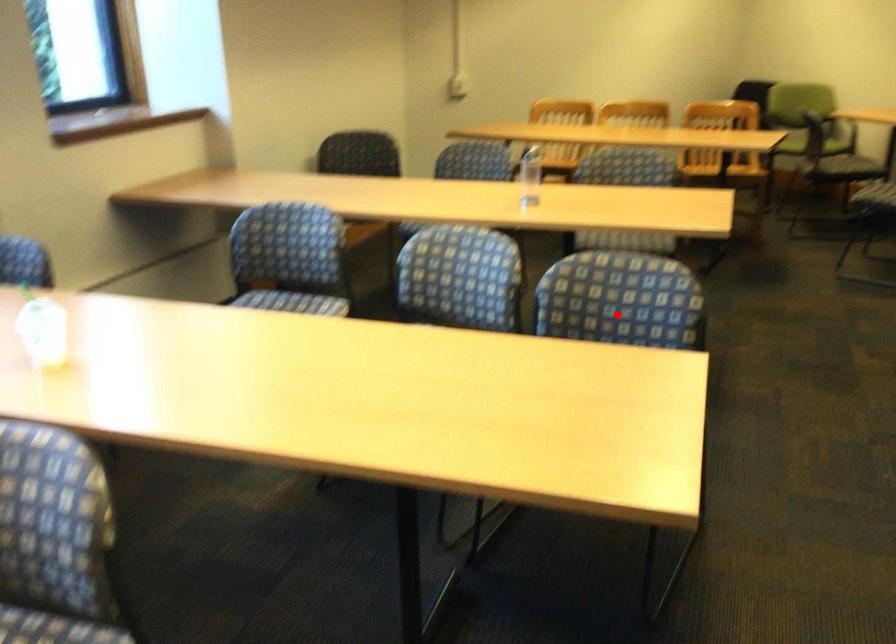
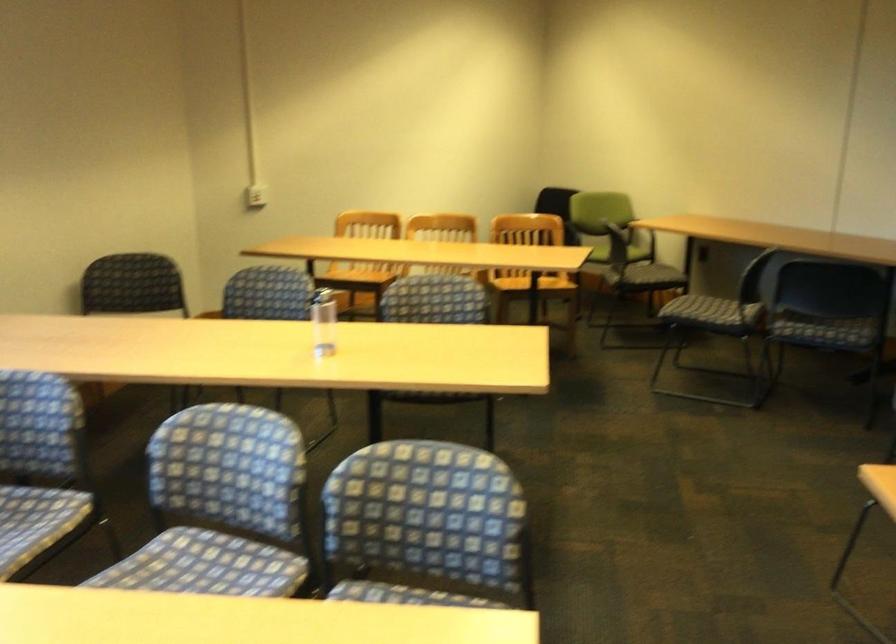
Question: A red point is marked in image1. In image2, is the corresponding 3D point closer to the camera or farther? Reply with the corresponding letter.

Choices:
 (A) The corresponding 3D point is closer.
 (B) The corresponding 3D point is farther.

Answer: (A)